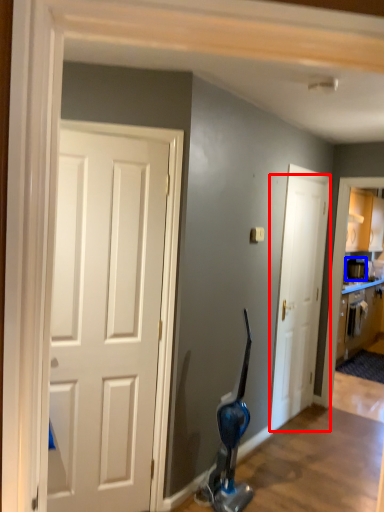
Question: Which point is closer to the camera, door (highlighted by a red box) or appliance (highlighted by a blue box)?

Choices:
 (A) door
 (B) appliance

Answer: (A)